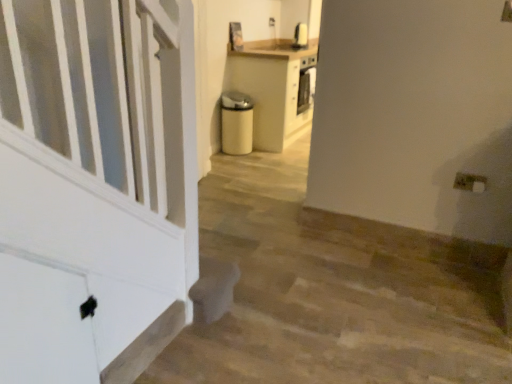
Question: Which is correct: white plastic electric outlet at lower right is inside white matte stairwell at lower left, or outside of it?

Choices:
 (A) inside
 (B) outside

Answer: (B)

Question: Is white plastic electric outlet at lower right wider or thinner than white matte stairwell at lower left?

Choices:
 (A) thin
 (B) wide

Answer: (B)

Question: Is white plastic electric outlet at lower right taller or shorter than white matte stairwell at lower left?

Choices:
 (A) short
 (B) tall

Answer: (A)

Question: From their relative heights in the image, would you say white matte stairwell at lower left is taller or shorter than white plastic electric outlet at lower right?

Choices:
 (A) short
 (B) tall

Answer: (B)

Question: Is white matte stairwell at lower left wider or thinner than white plastic electric outlet at lower right?

Choices:
 (A) thin
 (B) wide

Answer: (A)

Question: From the image's perspective, is white matte stairwell at lower left positioned above or below white plastic electric outlet at lower right?

Choices:
 (A) below
 (B) above

Answer: (A)

Question: In the image, is white matte stairwell at lower left positioned in front of or behind white plastic electric outlet at lower right?

Choices:
 (A) behind
 (B) front

Answer: (B)